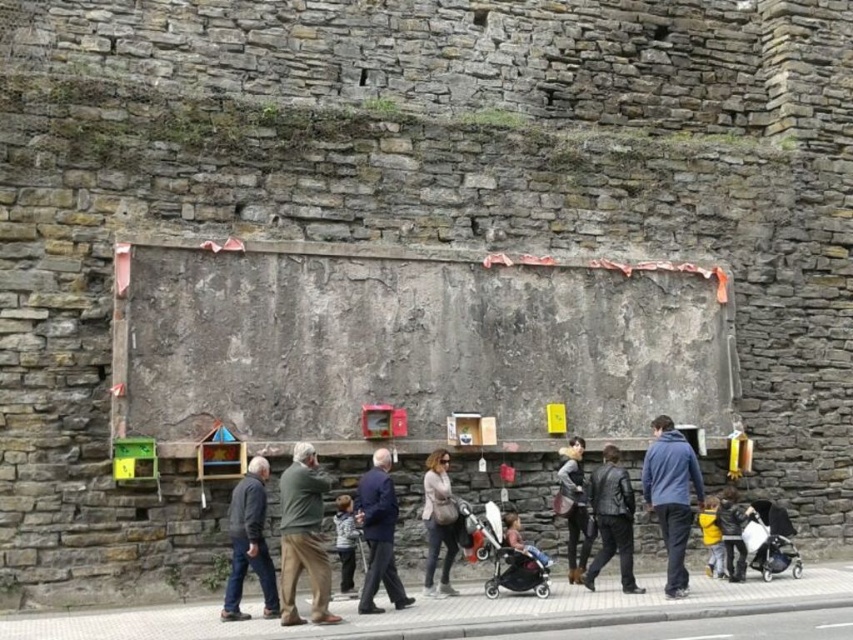
Does white concrete pavement at lower center appear on the left side of green wool sweater at center?

No, white concrete pavement at lower center is not to the left of green wool sweater at center.

Identify the location of white concrete pavement at lower center. (463, 612).

Between green wool sweater at center and dark blue suit at center, which one has more height?

dark blue suit at center is taller.

Which is in front, point (310, 515) or point (373, 577)?

Positioned in front is point (310, 515).

Find the location of a particular element. green wool sweater at center is located at coordinates (303, 536).

Does green wool sweater at center have a larger size compared to light brown leather stroller at center?

No, green wool sweater at center is not bigger than light brown leather stroller at center.

Can you confirm if green wool sweater at center is positioned above light brown leather stroller at center?

Indeed, green wool sweater at center is positioned over light brown leather stroller at center.

Where is `green wool sweater at center`? Image resolution: width=853 pixels, height=640 pixels. green wool sweater at center is located at coordinates (303, 536).